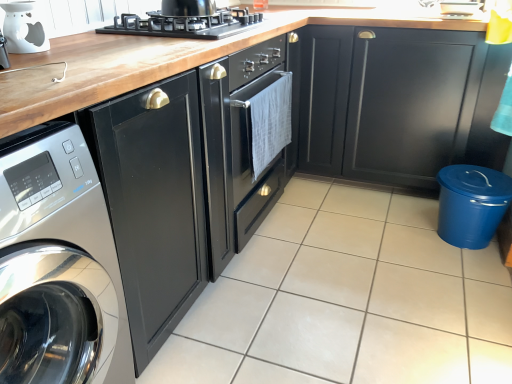
The width and height of the screenshot is (512, 384). What are the coordinates of `vacant space to the left of blue plastic trash can at lower right, which is counted as the 2th appliance, starting from the front` in the screenshot? It's located at (397, 235).